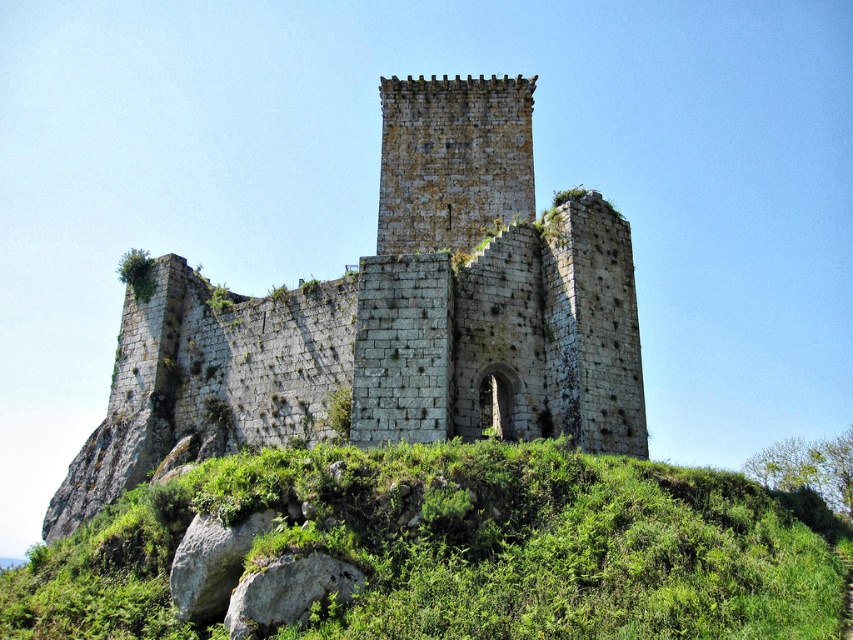
Question: Does rusty stone ruins at center appear over green grassy at center?

Choices:
 (A) yes
 (B) no

Answer: (A)

Question: Does rusty stone ruins at center appear under green grassy at center?

Choices:
 (A) no
 (B) yes

Answer: (A)

Question: Which point is closer to the camera taking this photo?

Choices:
 (A) (538, 541)
 (B) (390, 296)

Answer: (A)

Question: Which of the following is the farthest from the observer?

Choices:
 (A) rusty stone ruins at center
 (B) green grassy at center

Answer: (A)

Question: Is rusty stone ruins at center bigger than green grassy at center?

Choices:
 (A) yes
 (B) no

Answer: (A)